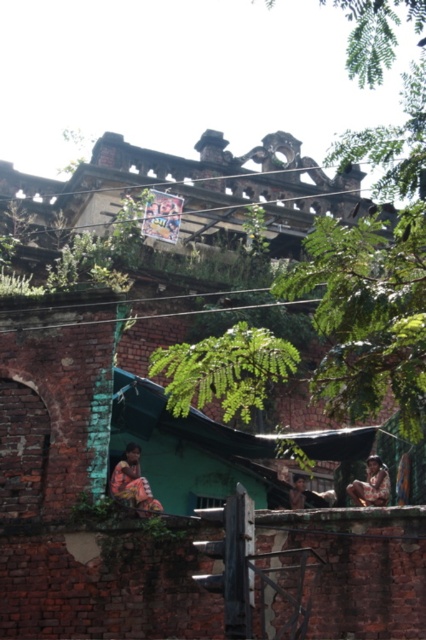
Question: From the image, what is the correct spatial relationship of green leafy tree at upper center in relation to brown textured fabric at center?

Choices:
 (A) right
 (B) left

Answer: (A)

Question: Which of these objects is positioned closest to the green leafy tree at upper center?

Choices:
 (A) brown textured fabric at center
 (B) multicolored fabric at lower left

Answer: (B)

Question: Is multicolored fabric at lower left wider than brown textured fabric at center?

Choices:
 (A) no
 (B) yes

Answer: (B)

Question: Which of the following is the closest to the observer?

Choices:
 (A) green leafy tree at upper center
 (B) multicolored fabric at lower left

Answer: (A)

Question: Does green leafy tree at upper center appear under brown textured fabric at center?

Choices:
 (A) yes
 (B) no

Answer: (B)

Question: Which point is farther from the camera taking this photo?

Choices:
 (A) (367, 502)
 (B) (333, 0)

Answer: (B)